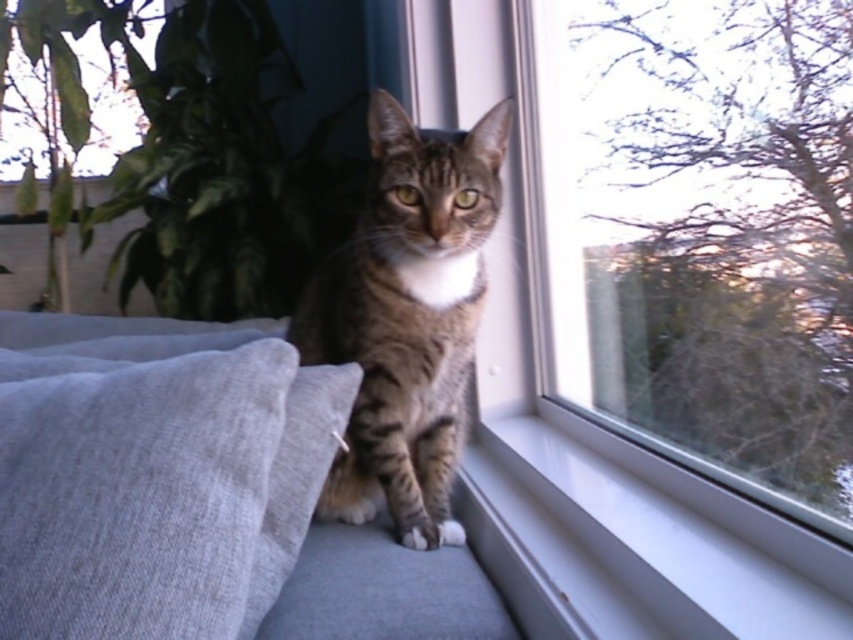
Question: Which of the following is the closest to the observer?

Choices:
 (A) tabby fur cat at center
 (B) light gray fabric couch at center

Answer: (B)

Question: Which of these objects is positioned farthest from the transparent glass window at center?

Choices:
 (A) tabby fur cat at center
 (B) light gray fabric couch at center

Answer: (B)

Question: From the image, what is the correct spatial relationship of light gray fabric couch at center in relation to tabby fur cat at center?

Choices:
 (A) below
 (B) above

Answer: (A)

Question: Can you confirm if transparent glass window at center is positioned to the left of tabby fur cat at center?

Choices:
 (A) yes
 (B) no

Answer: (B)

Question: Which point is closer to the camera?

Choices:
 (A) light gray fabric couch at center
 (B) transparent glass window at center

Answer: (B)

Question: In this image, where is transparent glass window at center located relative to tabby fur cat at center?

Choices:
 (A) right
 (B) left

Answer: (A)